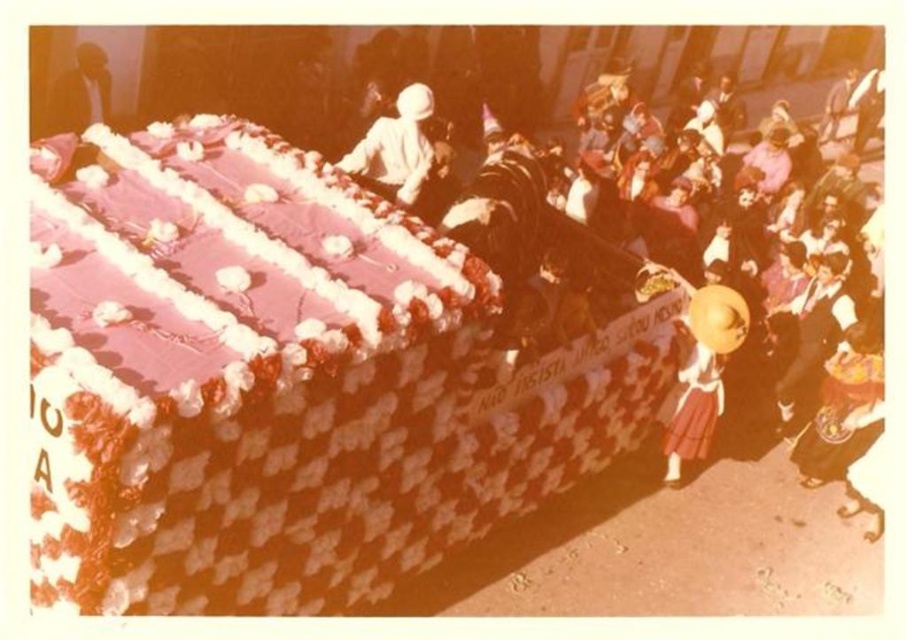
You are a photographer trying to capture a clear shot of the float. You notice the yellow straw hat at center and the dark brown leather jacket at upper left in your viewfinder. Which object should you adjust your camera angle to avoid blocking the float?

You should adjust your camera angle to avoid the yellow straw hat at center because it is taller than the dark brown leather jacket at upper left and might obstruct the view of the float.

You are a photographer standing at the back of the crowd. You want to take a photo of both the yellow straw hat at center and the white clothed figure at center. Which object will appear larger in your photo?

The yellow straw hat at center will appear larger in the photo because it is much taller than the white clothed figure at center.

You are a photographer trying to capture the float from a specific angle. You want to ensure that both the yellow straw hat at center and the dark brown leather jacket at upper left are visible in the frame. Based on their positions, which object should you focus on first to include both in the shot?

The yellow straw hat at center is positioned under the dark brown leather jacket at upper left. To include both in the frame, focus on the dark brown leather jacket at upper left first, as it is above the yellow straw hat at center and will allow you to capture the lower hat within the same shot.